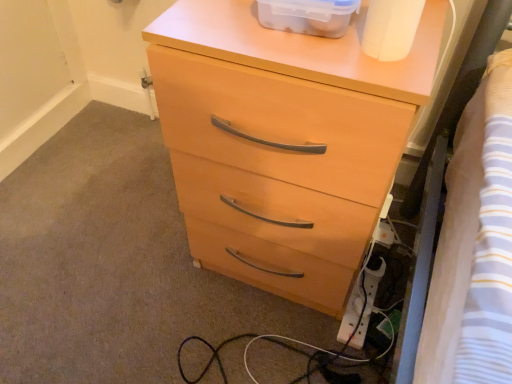
Question: Considering the relative sizes of matte wood chest of drawers at center and white plastic extension cord at lower right in the image provided, is matte wood chest of drawers at center smaller than white plastic extension cord at lower right?

Choices:
 (A) yes
 (B) no

Answer: (B)

Question: Considering the relative sizes of matte wood chest of drawers at center and white plastic extension cord at lower right in the image provided, is matte wood chest of drawers at center wider than white plastic extension cord at lower right?

Choices:
 (A) no
 (B) yes

Answer: (B)

Question: Can you confirm if matte wood chest of drawers at center is taller than white plastic extension cord at lower right?

Choices:
 (A) yes
 (B) no

Answer: (A)

Question: Does matte wood chest of drawers at center lie behind white plastic extension cord at lower right?

Choices:
 (A) no
 (B) yes

Answer: (A)

Question: From the image's perspective, is matte wood chest of drawers at center on white plastic extension cord at lower right?

Choices:
 (A) yes
 (B) no

Answer: (A)

Question: From the image's perspective, relative to translucent plastic container at upper center, is white plastic extension cord at lower right above or below?

Choices:
 (A) above
 (B) below

Answer: (B)

Question: From their relative heights in the image, would you say white plastic extension cord at lower right is taller or shorter than translucent plastic container at upper center?

Choices:
 (A) tall
 (B) short

Answer: (B)

Question: Would you say white plastic extension cord at lower right is to the left or to the right of translucent plastic container at upper center in the picture?

Choices:
 (A) left
 (B) right

Answer: (B)

Question: Looking at the image, does white plastic extension cord at lower right seem bigger or smaller compared to translucent plastic container at upper center?

Choices:
 (A) big
 (B) small

Answer: (B)

Question: Is point (333, 28) closer or farther from the camera than point (399, 34)?

Choices:
 (A) closer
 (B) farther

Answer: (B)

Question: In terms of width, does translucent plastic container at upper center look wider or thinner when compared to white matte toilet paper at upper right?

Choices:
 (A) thin
 (B) wide

Answer: (B)

Question: From the image's perspective, is translucent plastic container at upper center located above or below white matte toilet paper at upper right?

Choices:
 (A) below
 (B) above

Answer: (B)

Question: Which is correct: translucent plastic container at upper center is inside white matte toilet paper at upper right, or outside of it?

Choices:
 (A) outside
 (B) inside

Answer: (A)

Question: From the image's perspective, is white matte toilet paper at upper right positioned above or below matte wood chest of drawers at center?

Choices:
 (A) below
 (B) above

Answer: (B)

Question: Visually, is white matte toilet paper at upper right positioned to the left or to the right of matte wood chest of drawers at center?

Choices:
 (A) right
 (B) left

Answer: (A)